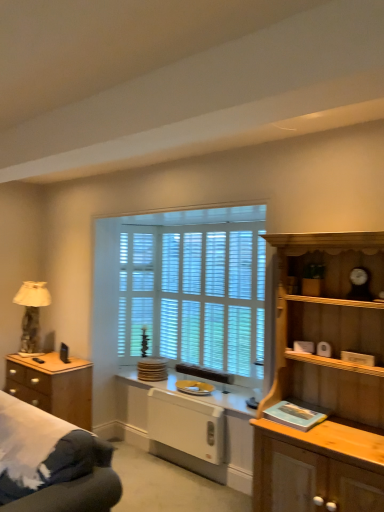
Question: Is white glossy radiator at lower center, which is the 2th appliance from top to bottom, facing away from brown wooden chest of drawers at left?

Choices:
 (A) yes
 (B) no

Answer: (B)

Question: Does white glossy radiator at lower center, arranged as the first appliance when ordered from the bottom, appear on the left side of brown wooden chest of drawers at left?

Choices:
 (A) yes
 (B) no

Answer: (B)

Question: From a real-world perspective, is white glossy radiator at lower center, arranged as the first appliance when ordered from the bottom, located beneath brown wooden chest of drawers at left?

Choices:
 (A) no
 (B) yes

Answer: (B)

Question: Is white glossy radiator at lower center, which is the 2th appliance from top to bottom, aimed at brown wooden chest of drawers at left?

Choices:
 (A) no
 (B) yes

Answer: (A)

Question: Can you confirm if white glossy radiator at lower center, which is the 2th appliance from top to bottom, is thinner than brown wooden chest of drawers at left?

Choices:
 (A) yes
 (B) no

Answer: (A)

Question: Is the depth of white glossy radiator at lower center, arranged as the first appliance when ordered from the bottom, less than that of brown wooden chest of drawers at left?

Choices:
 (A) no
 (B) yes

Answer: (B)

Question: Can you confirm if light wood cabinet at right is taller than beige fabric lampshade at left?

Choices:
 (A) yes
 (B) no

Answer: (A)

Question: From the image's perspective, is light wood cabinet at right beneath beige fabric lampshade at left?

Choices:
 (A) yes
 (B) no

Answer: (A)

Question: Would you say light wood cabinet at right contains beige fabric lampshade at left?

Choices:
 (A) no
 (B) yes

Answer: (A)

Question: From a real-world perspective, is light wood cabinet at right physically above beige fabric lampshade at left?

Choices:
 (A) yes
 (B) no

Answer: (B)

Question: Is light wood cabinet at right wider than beige fabric lampshade at left?

Choices:
 (A) no
 (B) yes

Answer: (B)

Question: Is light wood cabinet at right aimed at beige fabric lampshade at left?

Choices:
 (A) no
 (B) yes

Answer: (A)

Question: Does white wood blinds at center have a smaller size compared to beige fabric lampshade at left?

Choices:
 (A) no
 (B) yes

Answer: (B)